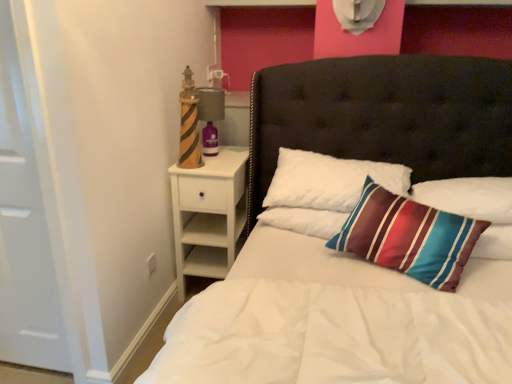
Question: Considering the relative sizes of white quilted bed at center and white quilted pillow at center, the second pillow in the right-to-left sequence, in the image provided, is white quilted bed at center taller than white quilted pillow at center, the second pillow in the right-to-left sequence,?

Choices:
 (A) no
 (B) yes

Answer: (B)

Question: Is white quilted bed at center smaller than white quilted pillow at center, arranged as the 1th pillow when viewed from the left?

Choices:
 (A) yes
 (B) no

Answer: (B)

Question: Is white quilted bed at center facing towards white quilted pillow at center, arranged as the 1th pillow when viewed from the left?

Choices:
 (A) yes
 (B) no

Answer: (B)

Question: Is white quilted bed at center at the left side of white quilted pillow at center, the second pillow in the right-to-left sequence?

Choices:
 (A) no
 (B) yes

Answer: (A)

Question: Does white quilted bed at center have a larger size compared to white quilted pillow at center, the second pillow in the right-to-left sequence?

Choices:
 (A) yes
 (B) no

Answer: (A)

Question: Is matte gray lamp at upper left to the left or to the right of white quilted pillow at center, arranged as the 1th pillow when viewed from the left, in the image?

Choices:
 (A) right
 (B) left

Answer: (B)

Question: Considering the positions of matte gray lamp at upper left and white quilted pillow at center, arranged as the 1th pillow when viewed from the left, in the image, is matte gray lamp at upper left taller or shorter than white quilted pillow at center, arranged as the 1th pillow when viewed from the left,?

Choices:
 (A) tall
 (B) short

Answer: (A)

Question: From the image's perspective, is matte gray lamp at upper left located above or below white quilted pillow at center, arranged as the 1th pillow when viewed from the left?

Choices:
 (A) above
 (B) below

Answer: (A)

Question: From a real-world perspective, relative to white quilted pillow at center, arranged as the 1th pillow when viewed from the left, is matte gray lamp at upper left vertically above or below?

Choices:
 (A) above
 (B) below

Answer: (A)

Question: Visually, is matte gray lamp at upper left positioned to the left or to the right of white wood nightstand at left?

Choices:
 (A) left
 (B) right

Answer: (A)

Question: In terms of size, does matte gray lamp at upper left appear bigger or smaller than white wood nightstand at left?

Choices:
 (A) big
 (B) small

Answer: (B)

Question: Is matte gray lamp at upper left inside the boundaries of white wood nightstand at left, or outside?

Choices:
 (A) outside
 (B) inside

Answer: (A)

Question: In the image, is matte gray lamp at upper left positioned in front of or behind white wood nightstand at left?

Choices:
 (A) front
 (B) behind

Answer: (B)

Question: Is white matte door at left in front of or behind white wood nightstand at left in the image?

Choices:
 (A) behind
 (B) front

Answer: (B)

Question: Based on their sizes in the image, would you say white matte door at left is bigger or smaller than white wood nightstand at left?

Choices:
 (A) big
 (B) small

Answer: (B)